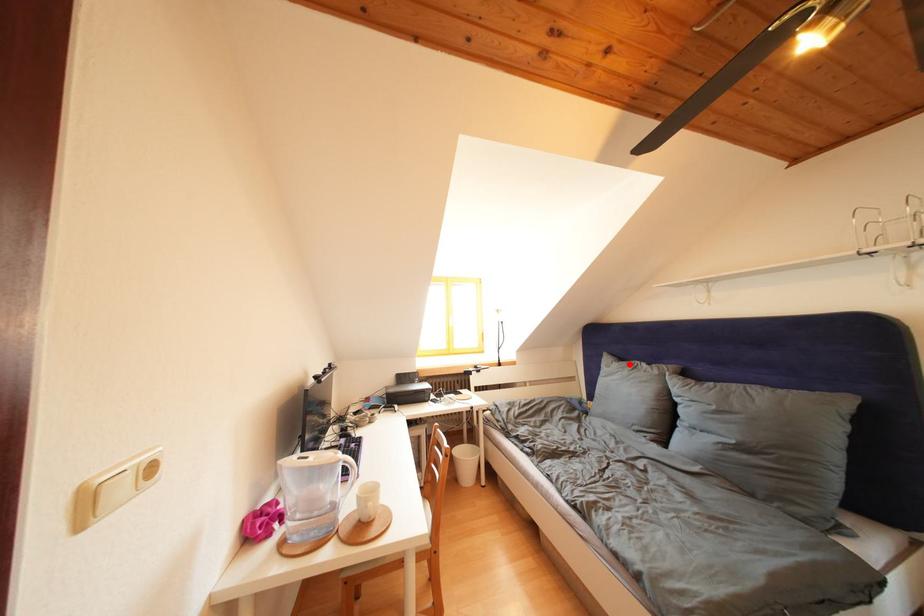
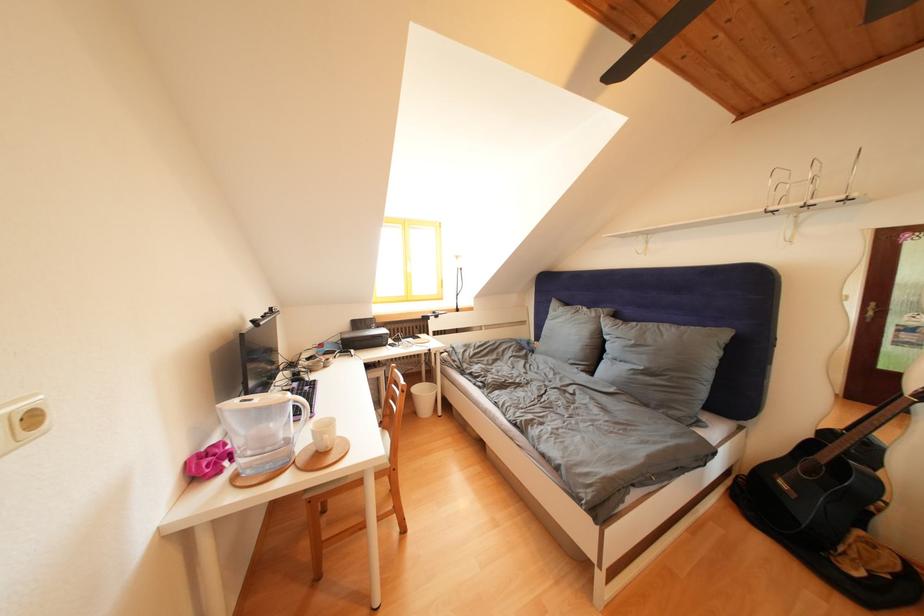
Find the pixel in the second image that matches the highlighted location in the first image.

(575, 310)